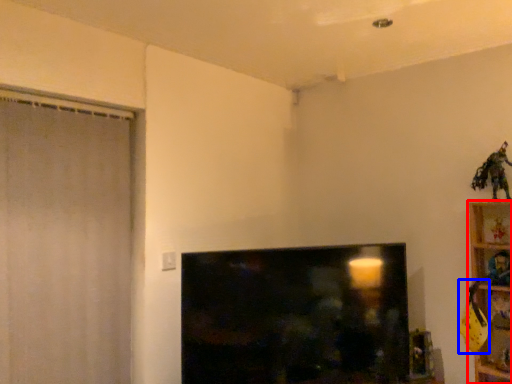
Question: Which of the following is the closest to the observer, furniture (highlighted by a red box) or toy (highlighted by a blue box)?

Choices:
 (A) furniture
 (B) toy

Answer: (A)